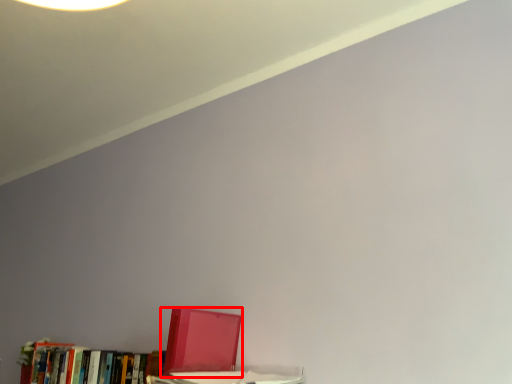
Question: From the image's perspective, where is book (annotated by the red box) located in relation to book in the image?

Choices:
 (A) below
 (B) above

Answer: (B)